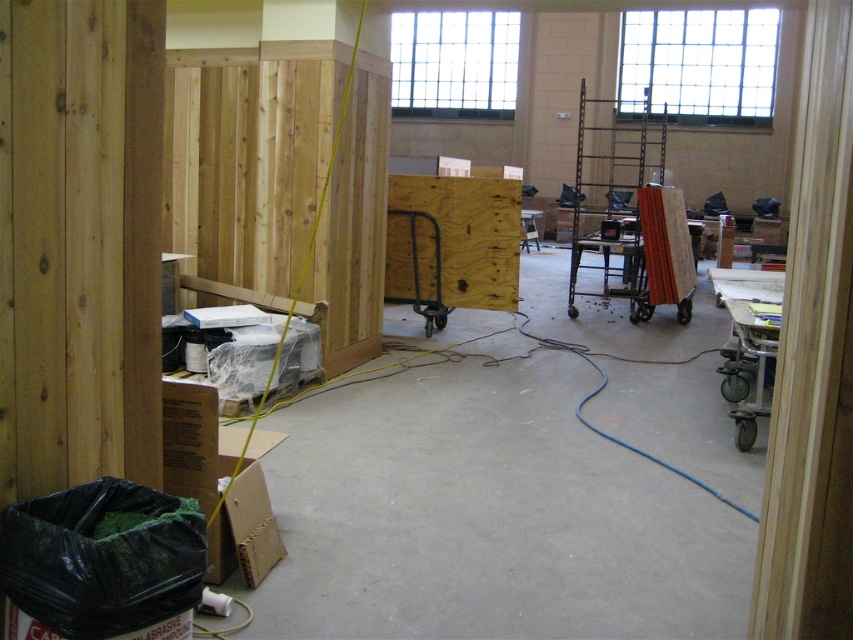
Can you confirm if metallic black rack at right is bigger than metallic silver cart at right?

Yes.

Between point (657, 150) and point (738, 300), which one is positioned behind?

The point (657, 150) is more distant.

Identify the location of metallic black rack at right. This screenshot has height=640, width=853. (614, 195).

What are the coordinates of `metallic black rack at right` in the screenshot? It's located at (614, 195).

Does metallic black rack at right have a greater width compared to wooden boards at center-right?

Yes.

Where is `metallic black rack at right`? metallic black rack at right is located at coordinates (614, 195).

In order to click on metallic black rack at right in this screenshot , I will do `click(614, 195)`.

Is point (770, 348) more distant than point (674, 240)?

No, it is not.

Does metallic silver cart at right appear over wooden boards at center-right?

No.

This screenshot has width=853, height=640. I want to click on metallic silver cart at right, so click(747, 344).